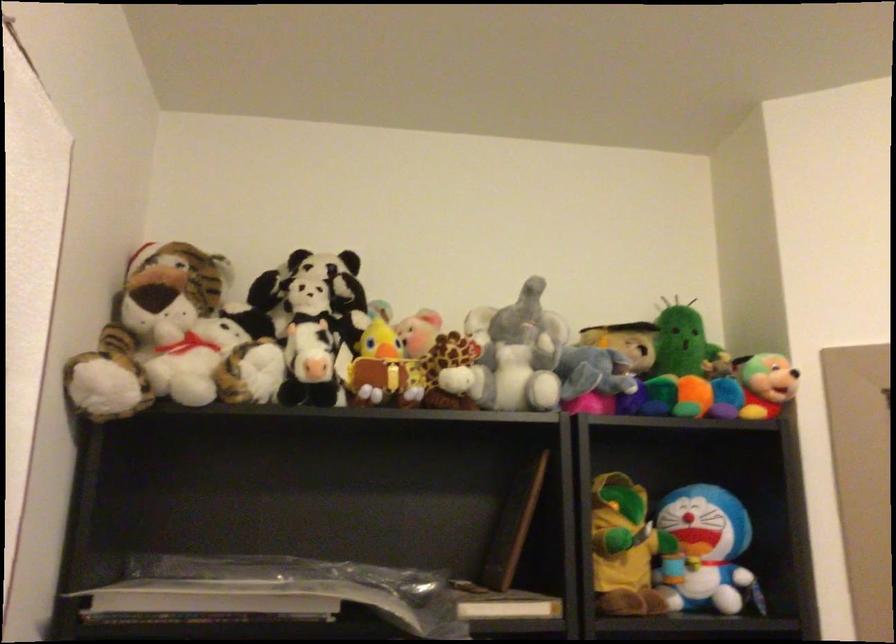
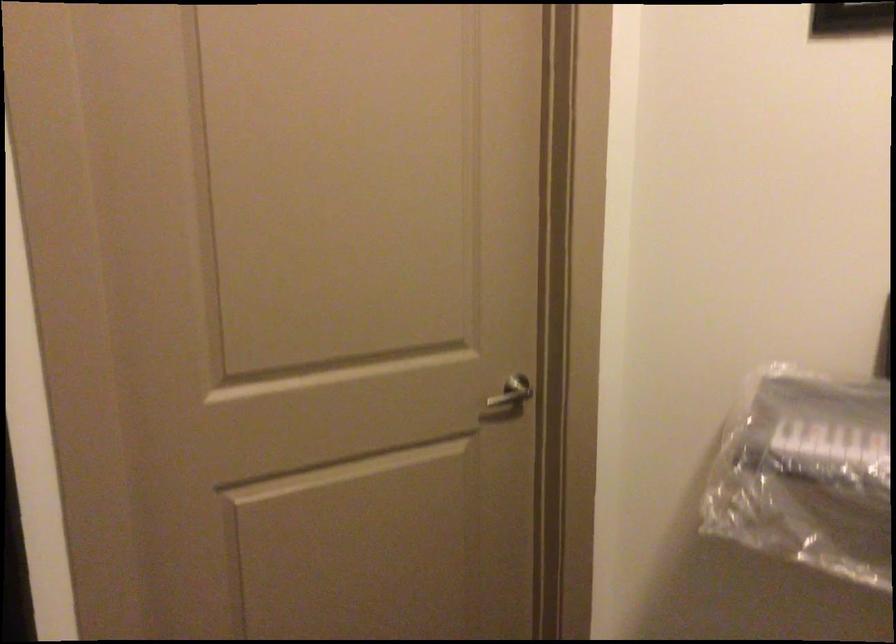
The images are taken continuously from a first-person perspective. In which direction is your viewpoint rotating?

The camera rotated toward right-down.